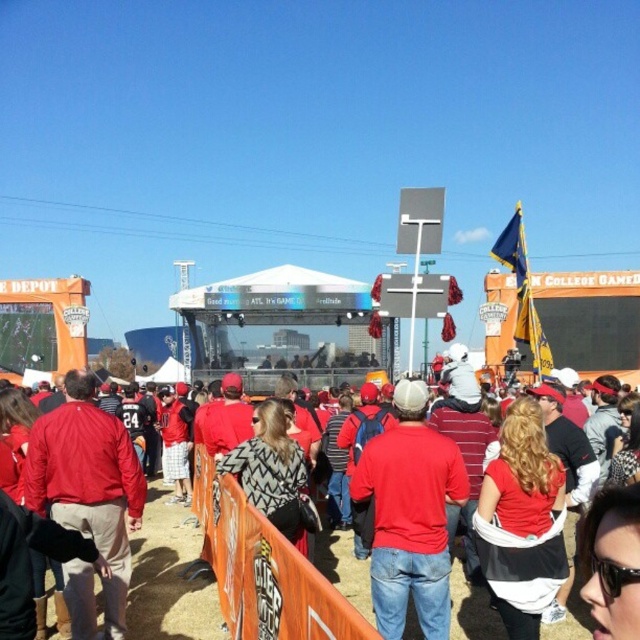
Question: Which point is closer to the camera?

Choices:
 (A) matte red jacket at center
 (B) red fabric jacket at center

Answer: (A)

Question: Can you confirm if matte red shirt at center is positioned to the right of red fabric jacket at center?

Choices:
 (A) yes
 (B) no

Answer: (A)

Question: Is red fabric jacket at center wider than matte red jacket at center?

Choices:
 (A) no
 (B) yes

Answer: (B)

Question: Can you confirm if red fabric jacket at center is smaller than matte red jacket at center?

Choices:
 (A) no
 (B) yes

Answer: (A)

Question: Which object is closer to the camera taking this photo?

Choices:
 (A) matte red shirt at center
 (B) red fabric jacket at center

Answer: (A)

Question: Among these objects, which one is nearest to the camera?

Choices:
 (A) red fabric jacket at center
 (B) matte red jacket at center

Answer: (B)